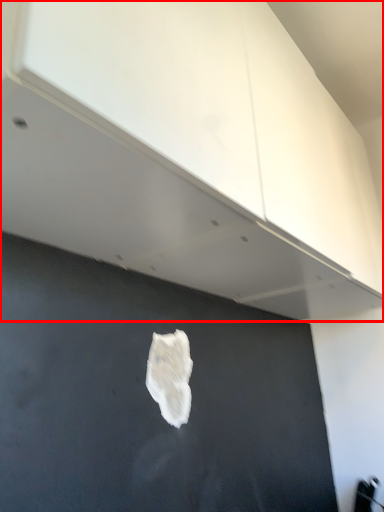
Question: From the image's perspective, considering the relative positions of cabinetry (annotated by the red box) and patch in the image provided, where is cabinetry (annotated by the red box) located with respect to the staircase?

Choices:
 (A) above
 (B) below

Answer: (A)